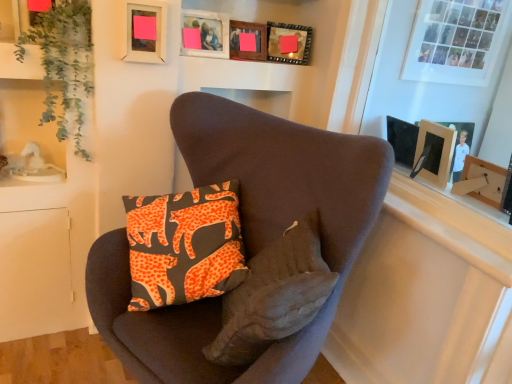
Question: Is green leafy plant at upper left in front of or behind velvet brown armchair at center in the image?

Choices:
 (A) behind
 (B) front

Answer: (A)

Question: From the image's perspective, relative to velvet brown armchair at center, is green leafy plant at upper left above or below?

Choices:
 (A) above
 (B) below

Answer: (A)

Question: Which of these objects is positioned farthest from the matte plastic picture frame at upper center, the 1th picture frame from the left?

Choices:
 (A) matte white photo frame at upper right
 (B) matte wooden picture frame at upper center, which is counted as the 2th picture frame, starting from the left
 (C) orange printed fabric pillow at center
 (D) wooden picture frame at upper center, the 2th picture frame from the right
 (E) velvet brown armchair at center

Answer: (A)

Question: Considering the real-world distances, which object is closest to the wooden picture frame at upper center, placed as the fourth picture frame when sorted from left to right?

Choices:
 (A) wooden picture frame at upper center, the third picture frame viewed from the left
 (B) green leafy plant at upper left
 (C) matte wooden picture frame at upper center, which is counted as the 2th picture frame, starting from the left
 (D) orange printed fabric pillow at center
 (E) velvet brown armchair at center

Answer: (A)